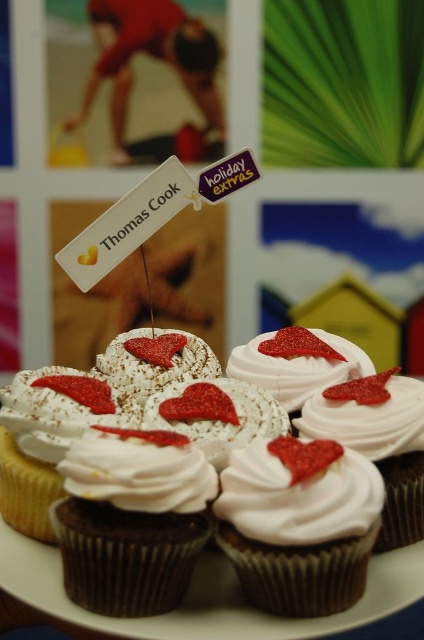
Question: Which of the following is the farthest from the observer?

Choices:
 (A) white matte cupcake at center
 (B) white matte frosting at center
 (C) white glossy frosting at center
 (D) white frosted cupcake with red glitter heart at center

Answer: (B)

Question: In this image, where is white frosted cupcake with red glitter heart at center located relative to white glossy frosting at center?

Choices:
 (A) right
 (B) left

Answer: (A)

Question: Which of the following is the farthest from the observer?

Choices:
 (A) (105, 490)
 (B) (340, 417)
 (C) (356, 449)
 (D) (53, 493)

Answer: (B)

Question: Which point is closer to the camera taking this photo?

Choices:
 (A) (385, 488)
 (B) (353, 442)
 (C) (94, 436)

Answer: (C)

Question: Can you confirm if white cream cupcake at center is smaller than white glossy frosting at center?

Choices:
 (A) yes
 (B) no

Answer: (B)

Question: Where is white matte cupcake at center located in relation to white fluffy frosting at center in the image?

Choices:
 (A) above
 (B) below

Answer: (B)